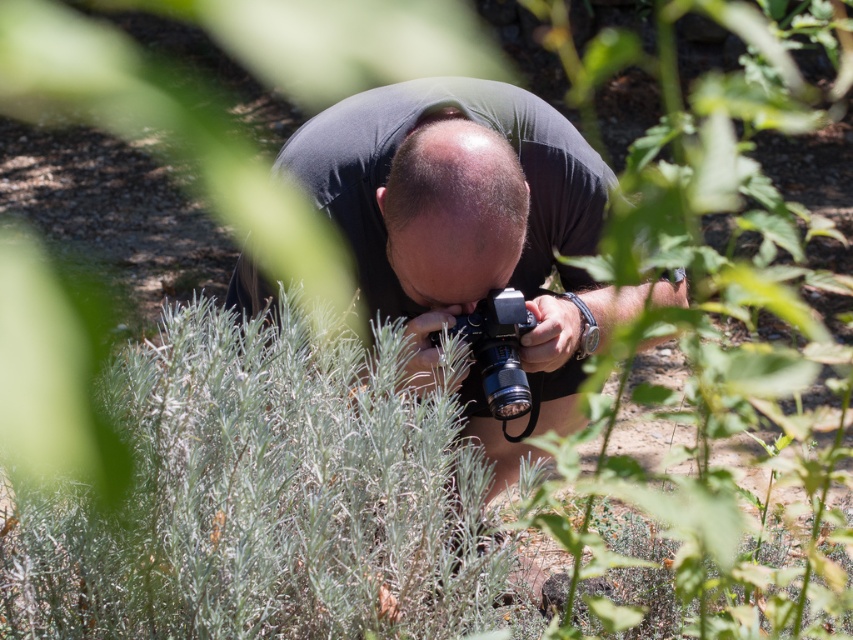
You are a photographer trying to decide which camera to use for a closeup shot. You have the black matte camera at center and the black plastic camera at center. Which camera is taller?

The black matte camera at center is taller than the black plastic camera at center.

You are a photographer trying to decide which camera to use for a closeup shot. You have two cameras in front of you, the black matte camera at center and the black plastic camera at center. According to the scene, which camera is positioned higher?

The black matte camera at center is above the black plastic camera at center, so it is positioned higher.